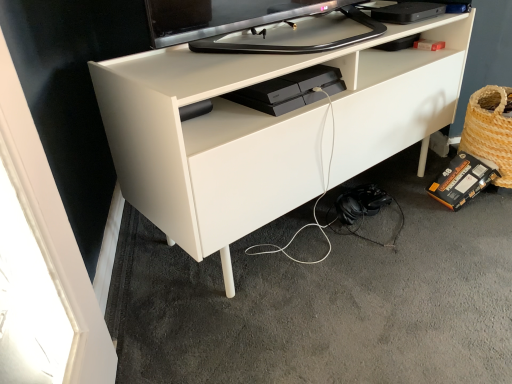
The image size is (512, 384). What do you see at coordinates (289, 90) in the screenshot?
I see `black plastic gaming console at center, which appears as the 2th equipment when ordered from the bottom` at bounding box center [289, 90].

Locate an element on the screen. The image size is (512, 384). woven straw basket at lower right is located at coordinates (490, 130).

Locate an element on the screen. The width and height of the screenshot is (512, 384). black matte headphones at lower right is located at coordinates (323, 303).

Find the location of `black plastic gaming console at center, which appears as the first equipment when viewed from the left`. black plastic gaming console at center, which appears as the first equipment when viewed from the left is located at coordinates (289, 90).

Is woven straw basket at lower right oriented towards white matte desk at center?

No.

Which of these two, woven straw basket at lower right or white matte desk at center, is wider?

white matte desk at center is wider.

Is point (485, 139) farther from camera compared to point (442, 72)?

No, (485, 139) is closer to viewer.

Which object is further away from the camera, woven straw basket at lower right or white matte desk at center?

woven straw basket at lower right is further from the camera.

Is white matte desk at center positioned far away from woven straw basket at lower right?

No.

Between point (234, 150) and point (500, 121), which one is positioned behind?

The point (500, 121) is farther from the camera.

How distant is white matte desk at center from woven straw basket at lower right?

A distance of 22.60 inches exists between white matte desk at center and woven straw basket at lower right.

In the image, is white matte desk at center positioned in front of or behind woven straw basket at lower right?

white matte desk at center is positioned closer to the viewer than woven straw basket at lower right.

Is point (281, 99) closer or farther from the camera than point (461, 147)?

Point (281, 99).

Is black plastic gaming console at center, the 1th equipment when ordered from front to back, positioned far away from woven straw basket at lower right?

black plastic gaming console at center, the 1th equipment when ordered from front to back, is actually quite close to woven straw basket at lower right.

Which object is positioned more to the right, black plastic gaming console at center, which appears as the first equipment when viewed from the left, or woven straw basket at lower right?

woven straw basket at lower right.

How far apart are black plastic gaming console at center, which appears as the first equipment when viewed from the left, and woven straw basket at lower right?

25.75 inches.

Is the position of white matte desk at center more distant than that of black matte headphones at lower right?

No, white matte desk at center is closer to the viewer.

Between point (233, 86) and point (135, 248), which one is positioned in front?

Positioned in front is point (233, 86).

Is white matte desk at center bigger than black matte headphones at lower right?

Indeed, white matte desk at center has a larger size compared to black matte headphones at lower right.

Which object is positioned more to the right, white matte desk at center or black matte headphones at lower right?

Positioned to the right is black matte headphones at lower right.

Does black plastic gaming console at center, positioned as the first equipment in top-to-bottom order, contain black cardboard box at lower right, the 2th equipment when ordered from top to bottom?

No, black cardboard box at lower right, the 2th equipment when ordered from top to bottom, is not inside black plastic gaming console at center, positioned as the first equipment in top-to-bottom order.

Based on the photo, is black plastic gaming console at center, the second equipment viewed from the back, in contact with black cardboard box at lower right, the 2th equipment positioned from the front?

black plastic gaming console at center, the second equipment viewed from the back, and black cardboard box at lower right, the 2th equipment positioned from the front, are not in contact.

Looking at their sizes, would you say black plastic gaming console at center, the second equipment when ordered from right to left, is wider or thinner than black cardboard box at lower right, the 1th equipment when ordered from back to front?

In the image, black plastic gaming console at center, the second equipment when ordered from right to left, appears to be wider than black cardboard box at lower right, the 1th equipment when ordered from back to front.

From the image's perspective, is black cardboard box at lower right, the 1th equipment when ordered from back to front, on top of woven straw basket at lower right?

Actually, black cardboard box at lower right, the 1th equipment when ordered from back to front, appears below woven straw basket at lower right in the image.

Is black cardboard box at lower right, the 1th equipment ordered from the bottom, taller or shorter than woven straw basket at lower right?

black cardboard box at lower right, the 1th equipment ordered from the bottom, is shorter than woven straw basket at lower right.

Can you confirm if black cardboard box at lower right, the 2th equipment positioned from the front, is bigger than woven straw basket at lower right?

No, black cardboard box at lower right, the 2th equipment positioned from the front, is not bigger than woven straw basket at lower right.

At what (x,y) coordinates should I click in order to perform the action: click on equipment that is under the woven straw basket at lower right (from a real-world perspective). Please return your answer as a coordinate pair (x, y). The image size is (512, 384). Looking at the image, I should click on (462, 180).

In terms of width, does black cardboard box at lower right, the 2th equipment positioned from the front, look wider or thinner when compared to black plastic gaming console at center, the 1th equipment when ordered from front to back?

Clearly, black cardboard box at lower right, the 2th equipment positioned from the front, has less width compared to black plastic gaming console at center, the 1th equipment when ordered from front to back.

Can you confirm if black cardboard box at lower right, the 2th equipment positioned from the front, is shorter than black plastic gaming console at center, the second equipment viewed from the back?

In fact, black cardboard box at lower right, the 2th equipment positioned from the front, may be taller than black plastic gaming console at center, the second equipment viewed from the back.

Looking at the image, does black cardboard box at lower right, the 1th equipment ordered from the bottom, seem bigger or smaller compared to black plastic gaming console at center, the second equipment viewed from the back?

Considering their sizes, black cardboard box at lower right, the 1th equipment ordered from the bottom, takes up more space than black plastic gaming console at center, the second equipment viewed from the back.

From a real-world perspective, is black cardboard box at lower right, the second equipment viewed from the left, positioned above or below black plastic gaming console at center, which appears as the 2th equipment when ordered from the bottom?

In terms of real-world spatial position, black cardboard box at lower right, the second equipment viewed from the left, is below black plastic gaming console at center, which appears as the 2th equipment when ordered from the bottom.

You are a GUI agent. You are given a task and a screenshot of the screen. Output one action in this format:
    pyautogui.click(x=<x>, y=<y>)
    Task: Click on the desk above the woven straw basket at lower right (from the image's perspective)
    Image resolution: width=512 pixels, height=384 pixels.
    Given the screenshot: What is the action you would take?
    pyautogui.click(x=266, y=130)

In order to click on basket lying below the white matte desk at center (from the image's perspective) in this screenshot , I will do `click(490, 130)`.

Considering their positions, is black matte headphones at lower right positioned further to black plastic gaming console at center, which appears as the 2th equipment when ordered from the bottom, than white matte desk at center?

black matte headphones at lower right is further to black plastic gaming console at center, which appears as the 2th equipment when ordered from the bottom.

Based on their spatial positions, is black plastic gaming console at center, the 1th equipment when ordered from front to back, or white matte desk at center further from black cardboard box at lower right, the 1th equipment ordered from the bottom?

The object further to black cardboard box at lower right, the 1th equipment ordered from the bottom, is black plastic gaming console at center, the 1th equipment when ordered from front to back.

When comparing their distances from white matte desk at center, does black plastic gaming console at center, positioned as the first equipment in top-to-bottom order, or woven straw basket at lower right seem further?

Among the two, woven straw basket at lower right is located further to white matte desk at center.

Looking at the image, which one is located closer to black matte headphones at lower right, black cardboard box at lower right, the 1th equipment when ordered from back to front, or black plastic gaming console at center, the 1th equipment when ordered from front to back?

black cardboard box at lower right, the 1th equipment when ordered from back to front, is positioned closer to the anchor black matte headphones at lower right.

Which object lies further to the anchor point black matte headphones at lower right, black plastic gaming console at center, which appears as the 2th equipment when ordered from the bottom, or woven straw basket at lower right?

The object further to black matte headphones at lower right is woven straw basket at lower right.

Consider the image. Looking at the image, which one is located further to white matte desk at center, black cardboard box at lower right, the second equipment viewed from the left, or black matte headphones at lower right?

Among the two, black cardboard box at lower right, the second equipment viewed from the left, is located further to white matte desk at center.

When comparing their distances from black matte headphones at lower right, does black plastic gaming console at center, which appears as the first equipment when viewed from the left, or black cardboard box at lower right, marked as the 1th equipment in a right-to-left arrangement, seem closer?

black cardboard box at lower right, marked as the 1th equipment in a right-to-left arrangement.

Estimate the real-world distances between objects in this image. Which object is further from black plastic gaming console at center, the 1th equipment when ordered from front to back, black cardboard box at lower right, the 1th equipment when ordered from back to front, or woven straw basket at lower right?

black cardboard box at lower right, the 1th equipment when ordered from back to front, is positioned further to the anchor black plastic gaming console at center, the 1th equipment when ordered from front to back.

Where is `concrete between white matte desk at center and woven straw basket at lower right from left to right`? This screenshot has width=512, height=384. concrete between white matte desk at center and woven straw basket at lower right from left to right is located at coordinates (323, 303).

Find the location of a particular element. The height and width of the screenshot is (384, 512). concrete positioned between white matte desk at center and black cardboard box at lower right, the 1th equipment when ordered from back to front, from near to far is located at coordinates (323, 303).

Locate an element on the screen. This screenshot has width=512, height=384. desk between black plastic gaming console at center, which appears as the 2th equipment when ordered from the bottom, and black matte headphones at lower right, in the vertical direction is located at coordinates (266, 130).

Locate an element on the screen. This screenshot has width=512, height=384. concrete located between black plastic gaming console at center, the 1th equipment when ordered from front to back, and woven straw basket at lower right in the left-right direction is located at coordinates (323, 303).